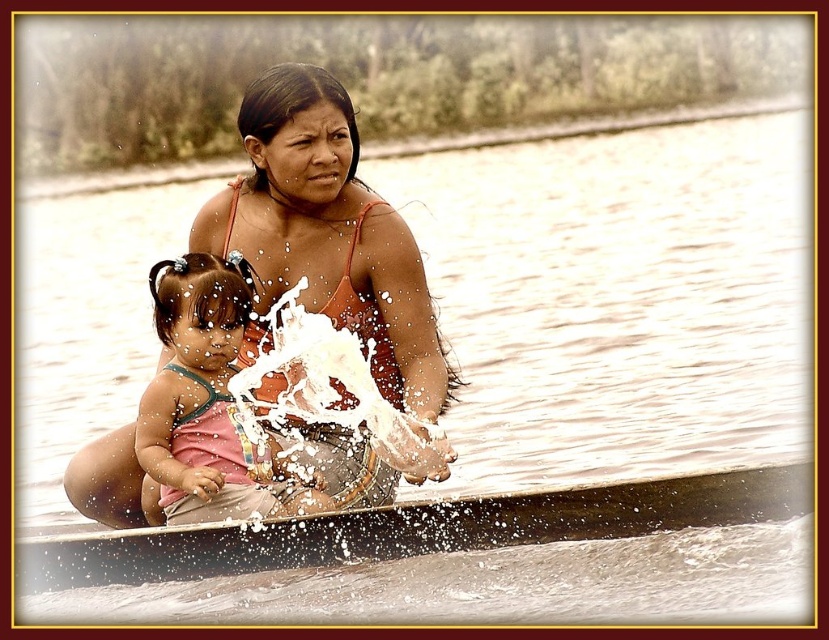
You are a photographer trying to capture a clear photo of the pink fabric dress at center. However, the matte orange tank top at center is blocking your view. Can you adjust your position to avoid the obstruction?

The matte orange tank top at center is in front of the pink fabric dress at center, so moving your camera position behind the tank top or to the side might allow you to see the dress without obstruction.

You are a photographer trying to capture the scene of the matte orange tank top at center and the wooden canoe at center. Which object is positioned higher in the image?

The matte orange tank top at center is located above the wooden canoe at center, so it is positioned higher in the image.

You are standing on a dock and want to throw a small toy to both the matte orange tank top at center and the pink fabric dress at center. What is the minimum distance you need to throw the toy to reach both?

The minimum distance you need to throw the toy is 3.04 meters, as the matte orange tank top at center and the pink fabric dress at center are 3.04 meters apart.